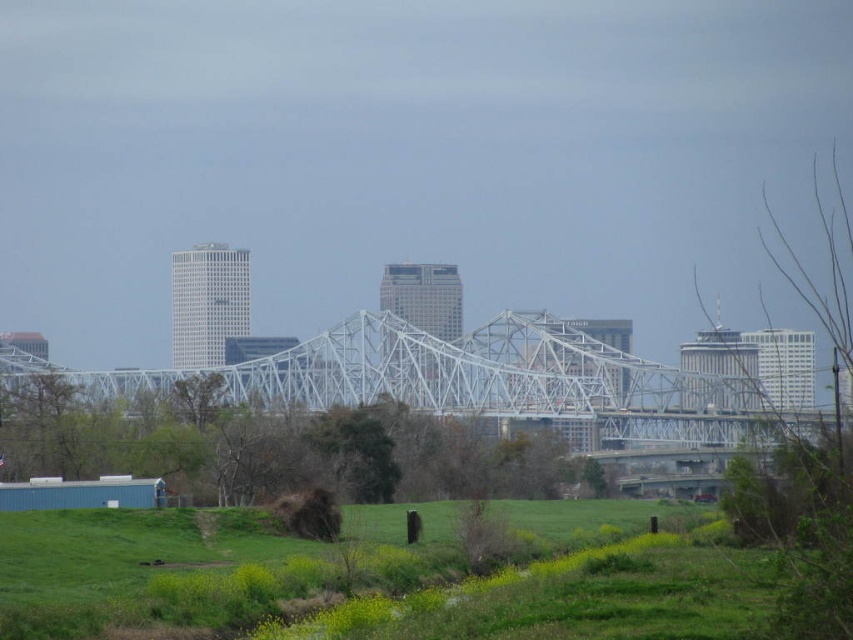
Based on the photo, you are a bird flying over the urban landscape described. You want to land on a tree that is larger in size. Which tree should you choose between the green leafy tree at center and the bare branches at right?

The bare branches at right are larger in size compared to the green leafy tree at center, so you should choose the bare branches at right to land on.

Consider the image. You are a city planner reviewing this urban landscape. You need to assess whether the white metallic bridge at center and the bare branches at right can both be seen clearly in a proposed aerial photograph. Based on their spatial relationship, will the bridge be less obstructed than the branches?

The white metallic bridge at center occupies less space than the bare branches at right, so the bridge will be less obstructed and more visible in the aerial photograph compared to the branches.